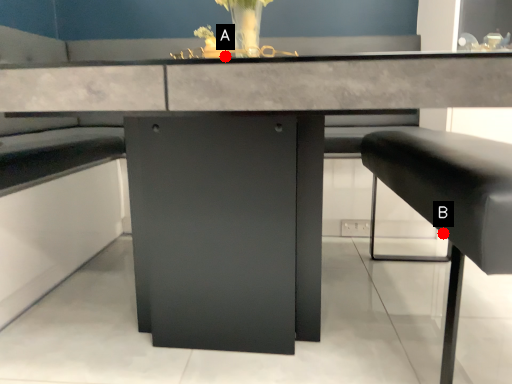
Question: Two points are circled on the image, labeled by A and B beside each circle. Among these points, which one is nearest to the camera?

Choices:
 (A) A is closer
 (B) B is closer

Answer: (B)